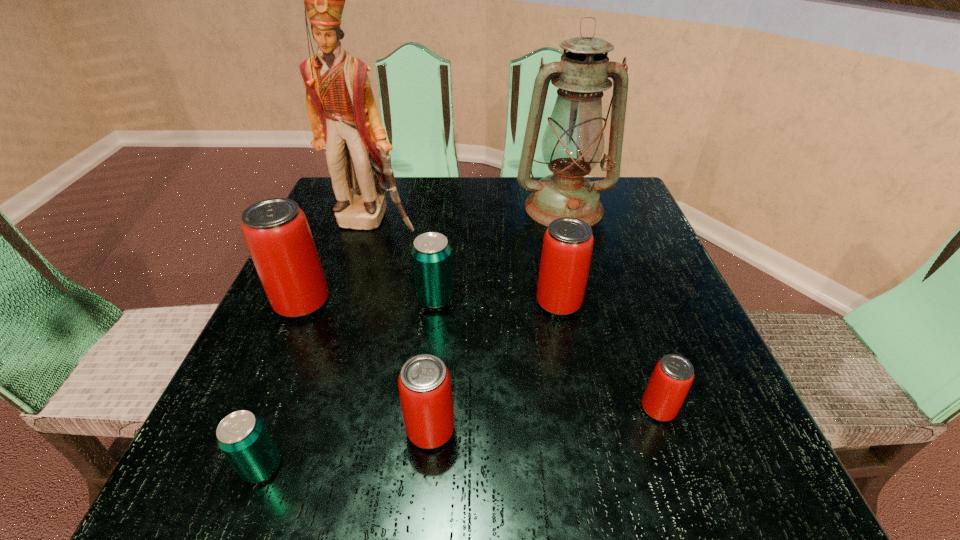
You are a GUI agent. You are given a task and a screenshot of the screen. Output one action in this format:
    pyautogui.click(x=<x>, y=<y>)
    Task: Click on the vacant area that lies between the farther teal beer can and the smaller teal beer can
    Image resolution: width=960 pixels, height=540 pixels.
    Given the screenshot: What is the action you would take?
    pyautogui.click(x=348, y=383)

Locate an element on the screen. object that stands as the closest to the third smallest pink beer can is located at coordinates (431, 254).

This screenshot has width=960, height=540. Identify the location of object identified as the sixth closest to the second pink beer can from right to left. (276, 231).

Where is `beer can that is the sixth closest one to the oil lamp`? The height and width of the screenshot is (540, 960). beer can that is the sixth closest one to the oil lamp is located at coordinates (242, 437).

Find the location of a particular element. beer can that stands as the fifth closest to the smaller teal beer can is located at coordinates (673, 375).

The height and width of the screenshot is (540, 960). I want to click on the closest pink beer can relative to the smallest pink beer can, so click(567, 247).

Identify the location of the closest pink beer can to the nutcracker. The height and width of the screenshot is (540, 960). (276, 231).

Where is `free region that satisfies the following two spatial constraints: 1. on the front side of the bigger teal beer can; 2. on the left side of the rightmost beer can`? The width and height of the screenshot is (960, 540). free region that satisfies the following two spatial constraints: 1. on the front side of the bigger teal beer can; 2. on the left side of the rightmost beer can is located at coordinates (423, 409).